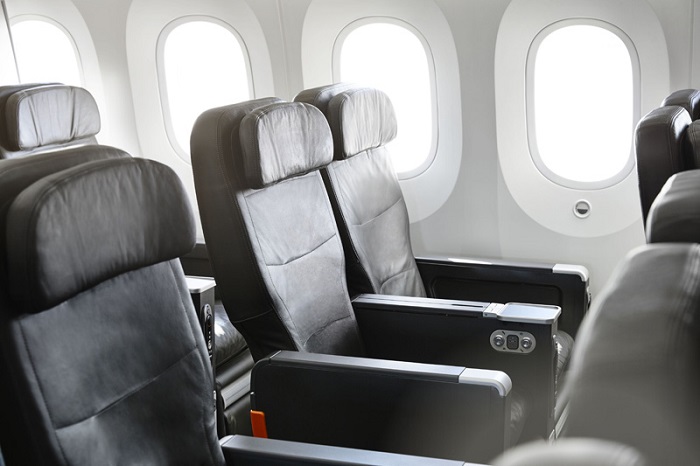
The image size is (700, 466). What are the coordinates of `armrests` in the screenshot? It's located at (202, 291), (466, 258), (451, 306), (398, 365), (290, 447), (197, 250).